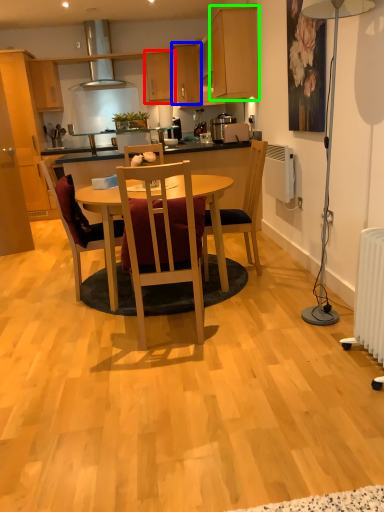
Question: Which object is the farthest from cabinetry (highlighted by a red box)? Choose among these: cabinetry (highlighted by a blue box) or cabinetry (highlighted by a green box).

Choices:
 (A) cabinetry
 (B) cabinetry

Answer: (B)